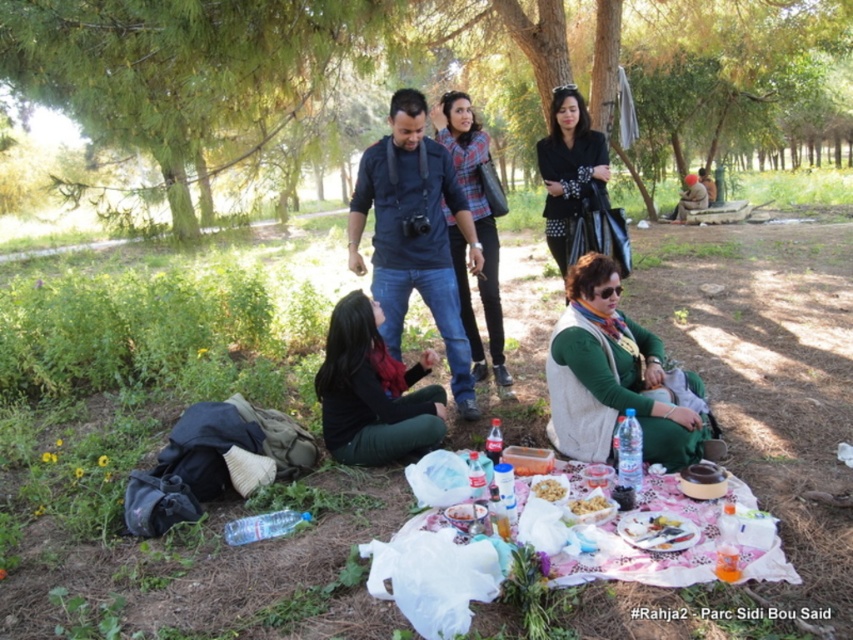
You are at a picnic and need to grab your jacket. You see both the matte black jacket at center and the black leather jacket at center. Which one is closer to your left side?

The matte black jacket at center is closer to your left side because it is positioned to the left of the black leather jacket at center.

You are a photographer trying to capture the picnic scene. You want to ensure both the matte black jacket at center and the black leather jacket at center are visible in your shot. Which jacket should you focus on first to ensure it doesn t get obscured by the other?

The matte black jacket at center is located below the black leather jacket at center. To prevent the matte black jacket at center from being obscured by the black leather jacket at center, focus on the black leather jacket at center first since it is positioned above.